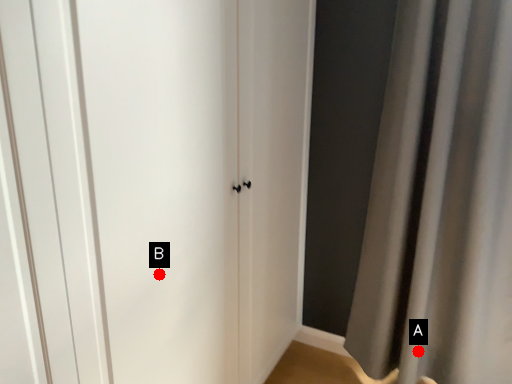
Question: Two points are circled on the image, labeled by A and B beside each circle. Which of the following is the closest to the observer?

Choices:
 (A) A is closer
 (B) B is closer

Answer: (B)